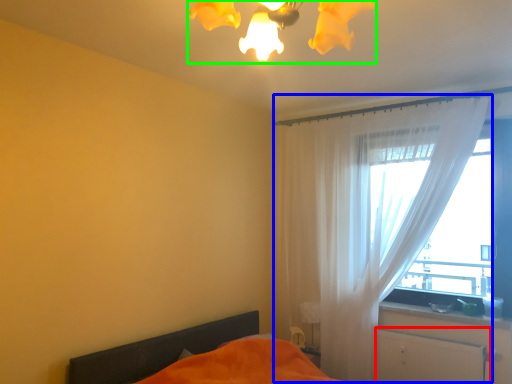
Question: Which object is positioned farthest from radiator (highlighted by a red box)? Select from curtain (highlighted by a blue box) and light fixture (highlighted by a green box).

Choices:
 (A) curtain
 (B) light fixture

Answer: (B)